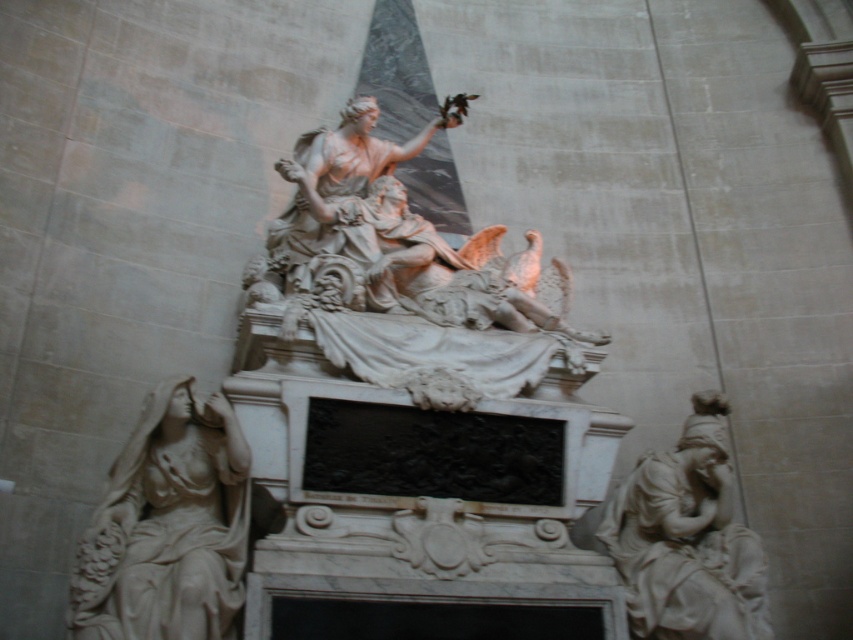
You are an art conservator tasked with moving a 10 meter long protective cover from the white marble statue at center to the white marble statue at lower right. Can you move it without folding the cover?

The distance between the white marble statue at center and the white marble statue at lower right is 12.45 meters, which is longer than the 10 meter cover. Therefore, the cover cannot reach without folding.